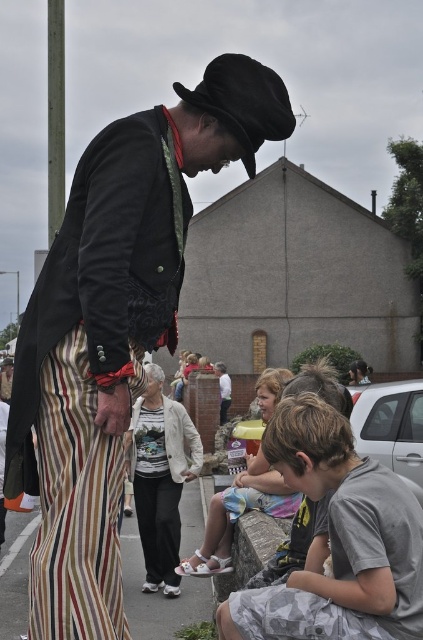
You are a photographer positioned at the center of the scene. You need to capture a photo that includes both the striped fabric pants at center and the white cotton shirt at center. Given that your camera has a maximum focus range of 10 meters, will you be able to focus on both subjects simultaneously?

The striped fabric pants at center is 11.06 meters away from the white cotton shirt at center. Since the distance between them exceeds the camera maximum focus range of 10 meters, you cannot focus on both subjects simultaneously.

You are a photographer trying to capture the performer in the scene. Since you want to focus on the striped fabric pants at center and the white cotton shirt at center, which one should you adjust your camera focus to prioritize if you want the pants to appear clearer than the shirt?

The striped fabric pants at center is in front of the white cotton shirt at center, so focusing on the striped fabric pants at center will make them appear clearer.